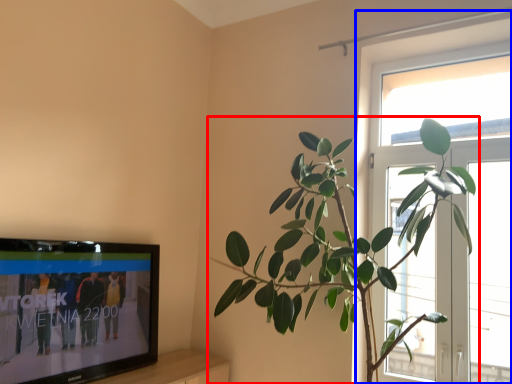
Question: Which object appears farthest to the camera in this image, houseplant (highlighted by a red box) or window (highlighted by a blue box)?

Choices:
 (A) houseplant
 (B) window

Answer: (B)